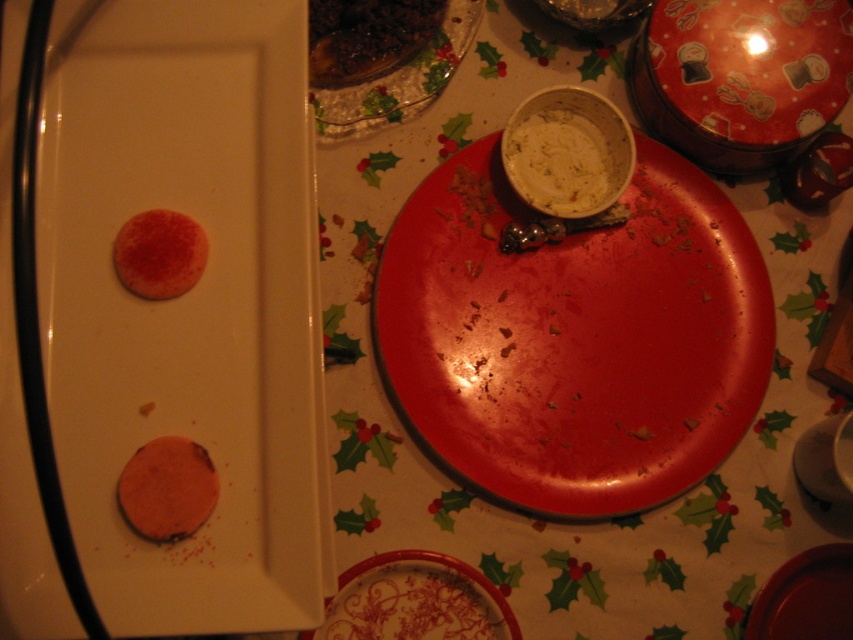
You are a guest at a holiday dinner and see the porcelain plate with floral design at lower center and the white creamy dip at upper center on the table. Which item is closer to you?

The white creamy dip at upper center is closer to you because it is positioned above the porcelain plate with floral design at lower center.

You are a guest at a holiday dinner and want to place a small napkin on the table. You have a napkin that is 10 cm wide. Which object, the porcelain plate with floral design at lower center or the white creamy dip at upper center, will the napkin fit better under?

The napkin will fit better under the porcelain plate with floral design at lower center since its width surpasses that of the white creamy dip at upper center, meaning the plate is wider and can accommodate the 10 cm napkin more comfortably.